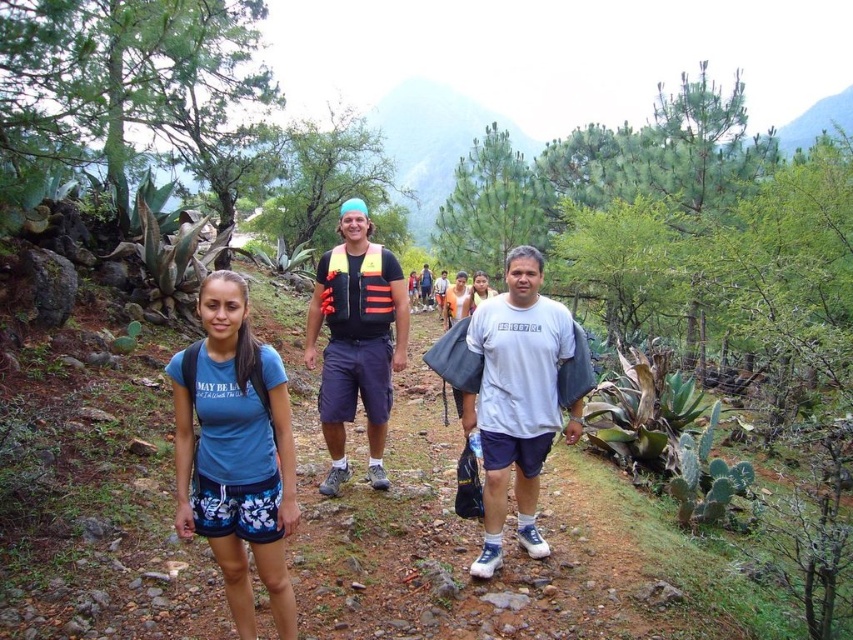
Between white matte t-shirt at center and orange life vest at center, which one has less height?

orange life vest at center

Is white matte t-shirt at center closer to the viewer compared to orange life vest at center?

Yes, white matte t-shirt at center is in front of orange life vest at center.

Which is behind, point (519, 275) or point (462, 308)?

Positioned behind is point (462, 308).

The width and height of the screenshot is (853, 640). What are the coordinates of `white matte t-shirt at center` in the screenshot? It's located at (515, 397).

Between orange life vest at center and white cotton shirt at center, which one appears on the left side from the viewer's perspective?

From the viewer's perspective, orange life vest at center appears more on the left side.

Does orange life vest at center have a smaller size compared to white cotton shirt at center?

No, orange life vest at center is not smaller than white cotton shirt at center.

Between point (482, 280) and point (485, 284), which one is positioned behind?

The point (482, 280) is behind.

Where is `orange life vest at center`? The height and width of the screenshot is (640, 853). orange life vest at center is located at coordinates (463, 296).

Can you confirm if orange mesh life vest at center is positioned to the left of white cotton shirt at center?

Correct, you'll find orange mesh life vest at center to the left of white cotton shirt at center.

Is point (340, 298) more distant than point (469, 304)?

That is False.

You are a GUI agent. You are given a task and a screenshot of the screen. Output one action in this format:
    pyautogui.click(x=<x>, y=<y>)
    Task: Click on the orange mesh life vest at center
    
    Given the screenshot: What is the action you would take?
    pyautogui.click(x=357, y=340)